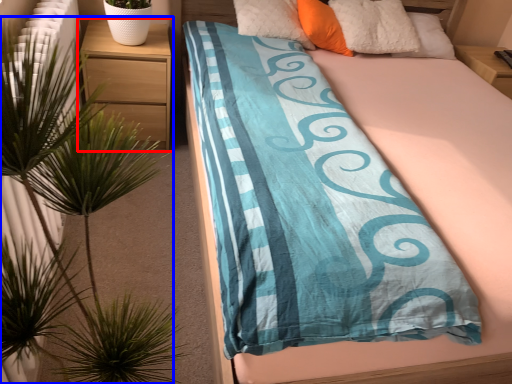
Question: Which point is further to the camera, nightstand (highlighted by a red box) or houseplant (highlighted by a blue box)?

Choices:
 (A) nightstand
 (B) houseplant

Answer: (A)